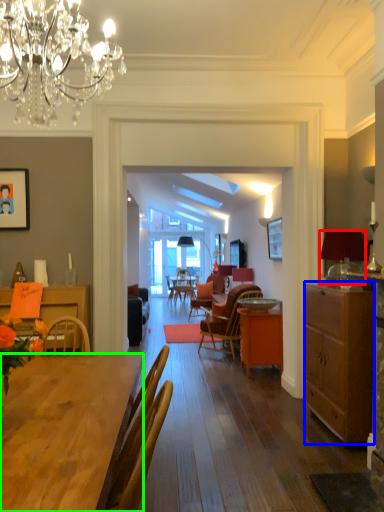
Question: Which is farther away from lamp (highlighted by a red box)? cabinetry (highlighted by a blue box) or desk (highlighted by a green box)?

Choices:
 (A) cabinetry
 (B) desk

Answer: (B)